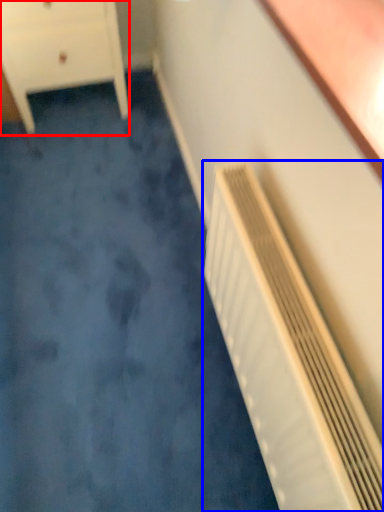
Question: Which object is closer to the camera taking this photo, chest of drawers (highlighted by a red box) or air conditioning (highlighted by a blue box)?

Choices:
 (A) chest of drawers
 (B) air conditioning

Answer: (B)